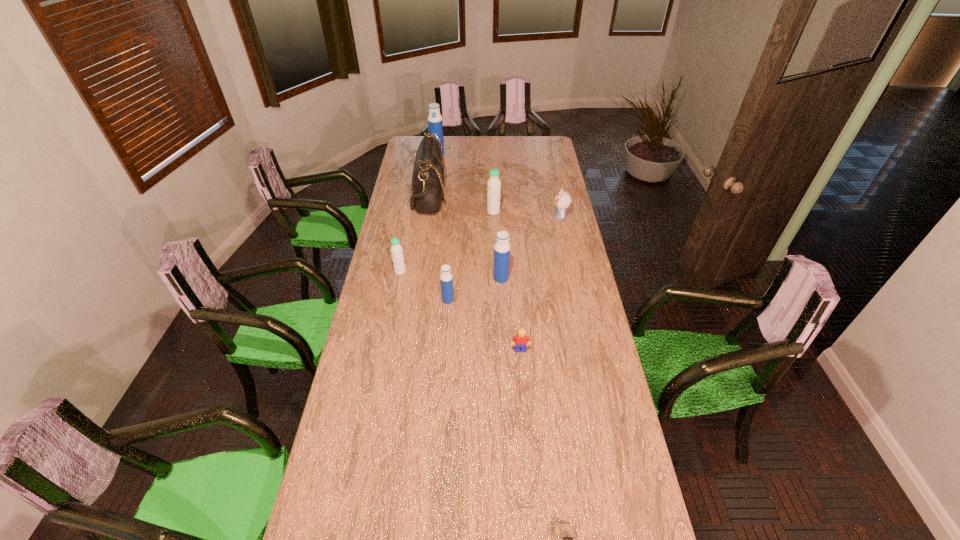
Where is `vacant region located 0.260m on the back of the fourth object from left to right`? This screenshot has height=540, width=960. vacant region located 0.260m on the back of the fourth object from left to right is located at coordinates (451, 254).

You are a GUI agent. You are given a task and a screenshot of the screen. Output one action in this format:
    pyautogui.click(x=<x>, y=<y>)
    Task: Click on the free location located on the front-facing side of the rightmost object
    This screenshot has width=960, height=540.
    Given the screenshot: What is the action you would take?
    490,217

You are a GUI agent. You are given a task and a screenshot of the screen. Output one action in this format:
    pyautogui.click(x=<x>, y=<y>)
    Task: Click on the vacant space located on the front-facing side of the rightmost object
    
    Given the screenshot: What is the action you would take?
    pyautogui.click(x=517, y=217)

At what (x,y) coordinates should I click in order to perform the action: click on vacant area situated 0.230m on the front-facing side of the rightmost object. Please return your answer as a coordinate pair (x, y). Image resolution: width=960 pixels, height=540 pixels. Looking at the image, I should click on (505, 217).

Find the location of a particular element. free region located 0.230m on the face of the eighth farthest object is located at coordinates (525, 410).

Image resolution: width=960 pixels, height=540 pixels. What are the coordinates of `object that is at the far edge` in the screenshot? It's located at (435, 125).

Find the location of a particular element. handbag present at the left edge is located at coordinates (428, 181).

Find the location of a particular element. This screenshot has width=960, height=540. object that is at the right edge is located at coordinates (562, 200).

The width and height of the screenshot is (960, 540). Identify the location of object that is positioned at the far left corner. (435, 125).

Image resolution: width=960 pixels, height=540 pixels. I want to click on free space at the far edge of the desktop, so click(509, 150).